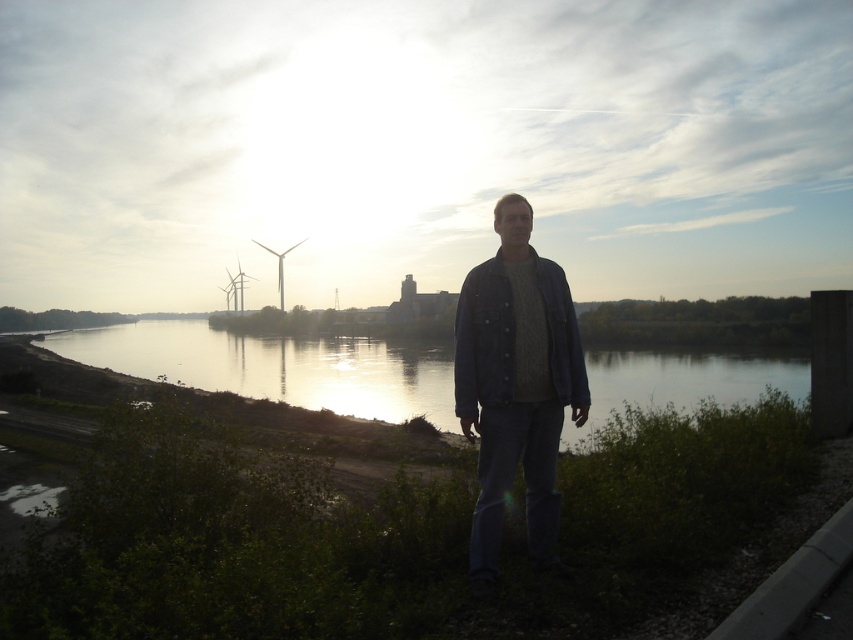
Is denim jacket at center bigger than metallic wind turbine at center?

No.

Can you confirm if denim jacket at center is taller than metallic wind turbine at center?

No.

This screenshot has height=640, width=853. I want to click on denim jacket at center, so (515, 381).

The height and width of the screenshot is (640, 853). What are the coordinates of `denim jacket at center` in the screenshot? It's located at (515, 381).

Which is more to the left, white plastic windmill at left or metallic wind turbine at center?

white plastic windmill at left

You are a GUI agent. You are given a task and a screenshot of the screen. Output one action in this format:
    pyautogui.click(x=<x>, y=<y>)
    Task: Click on the white plastic windmill at left
    This screenshot has width=853, height=640.
    Given the screenshot: What is the action you would take?
    pyautogui.click(x=236, y=285)

Identify the location of white plastic windmill at left. The image size is (853, 640). (236, 285).

Which of these two, silvery reflective water at center or white plastic windmill at left, stands taller?

With more height is white plastic windmill at left.

Which is behind, point (664, 364) or point (225, 273)?

Positioned behind is point (225, 273).

Identify the location of silvery reflective water at center. The height and width of the screenshot is (640, 853). (277, 365).